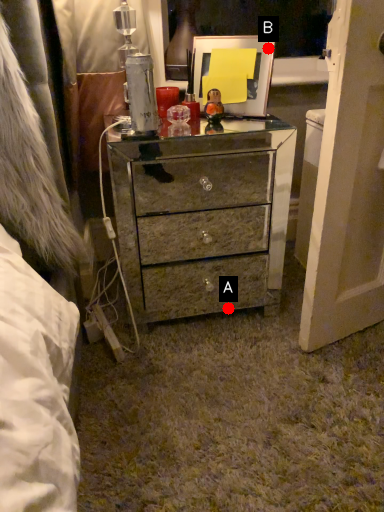
Question: Two points are circled on the image, labeled by A and B beside each circle. Which point is further to the camera?

Choices:
 (A) A is further
 (B) B is further

Answer: (A)